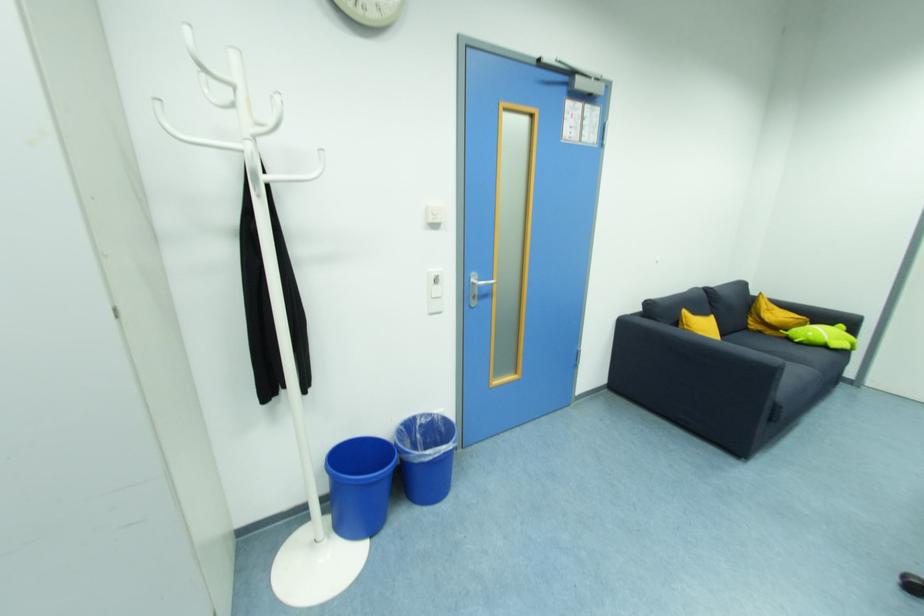
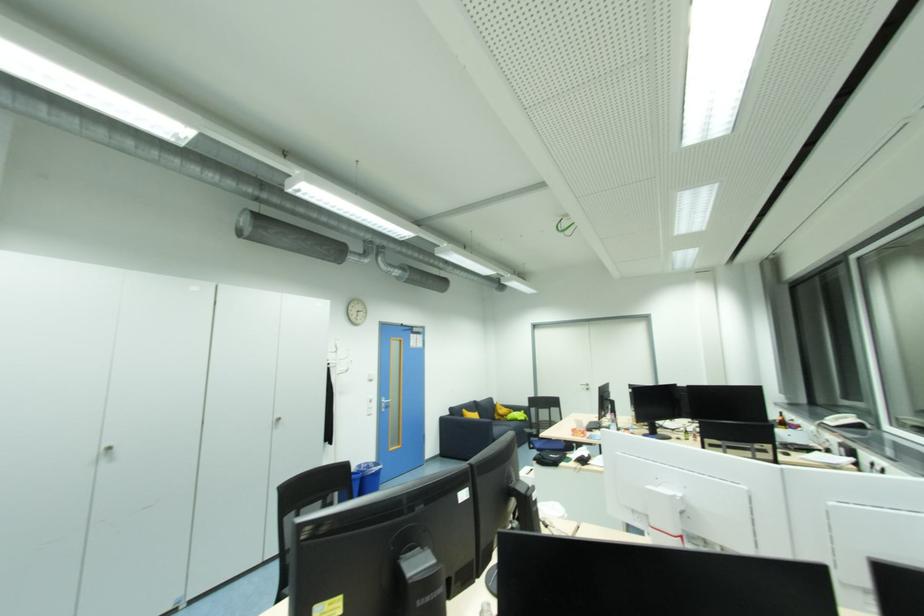
The point at (x=428, y=422) is marked in the first image. Where is the corresponding point in the second image?

(369, 466)